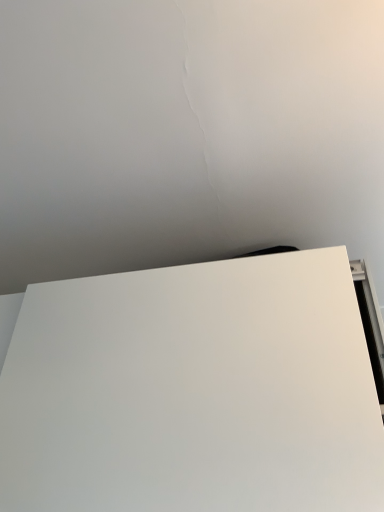
Describe the element at coordinates (187, 132) in the screenshot. I see `white matte board at lower right` at that location.

Locate an element on the screen. The width and height of the screenshot is (384, 512). white matte board at lower right is located at coordinates (187, 132).

You are a GUI agent. You are given a task and a screenshot of the screen. Output one action in this format:
    pyautogui.click(x=<x>, y=<y>)
    Task: Click on the white matte board at lower right
    This screenshot has width=384, height=512.
    Given the screenshot: What is the action you would take?
    pyautogui.click(x=187, y=132)